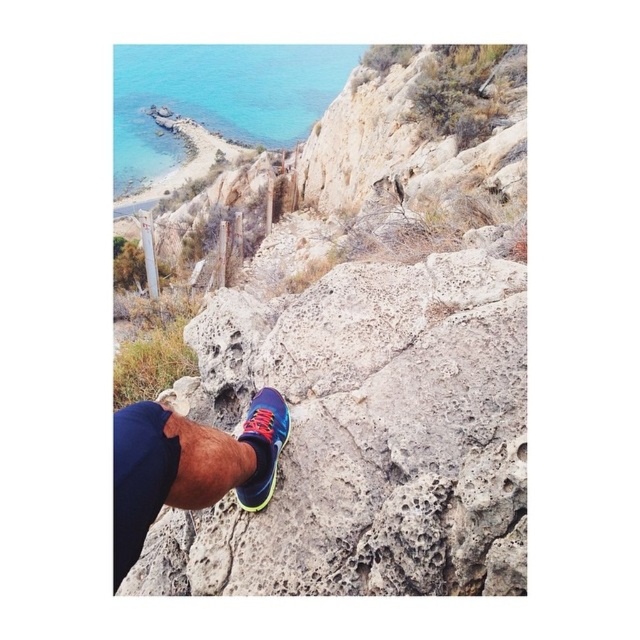
You are a hiker who wants to place a small rock between the shiny blue running shoe at center and the shiny blue running shoe at lower center. Which shoe should you place the rock closer to if you want it to be higher up?

You should place the rock closer to the shiny blue running shoe at lower center because the shiny blue running shoe at center is below it, so the lower center shoe is higher.

You are a hiker who wants to reach the turquoise glossy water at upper left from where you are standing at the shiny blue running shoe at center. Can you safely walk directly to the water without needing to climb or jump?

The distance between the turquoise glossy water at upper left and the shiny blue running shoe at center is 237.95 feet. Since the path is a steep incline composed of rugged light colored rocks and patches of dry vegetation, you would need to climb or use caution while walking directly to the water.

You are a hiker who just took a photo from a rocky cliff overlooking the coast. In your photo, there is a shiny blue running shoe at center. Based on the coordinates given, can you determine if the shoe is positioned closer to the top or bottom of the image?

The coordinates of the shiny blue running shoe at center are at point 0.730 on the x axis and 0.294 on the y axis. Since the y coordinate is closer to 0, which typically represents the bottom of an image, the shoe is positioned closer to the bottom of the image.